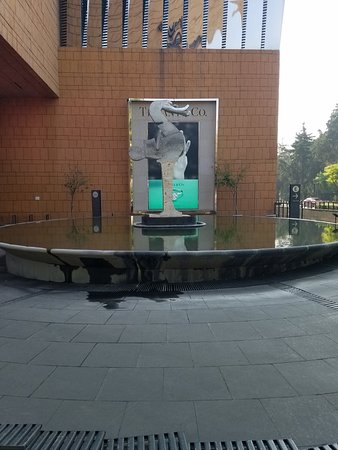
Where is `blue panel`? This screenshot has height=450, width=338. blue panel is located at coordinates tap(189, 196).